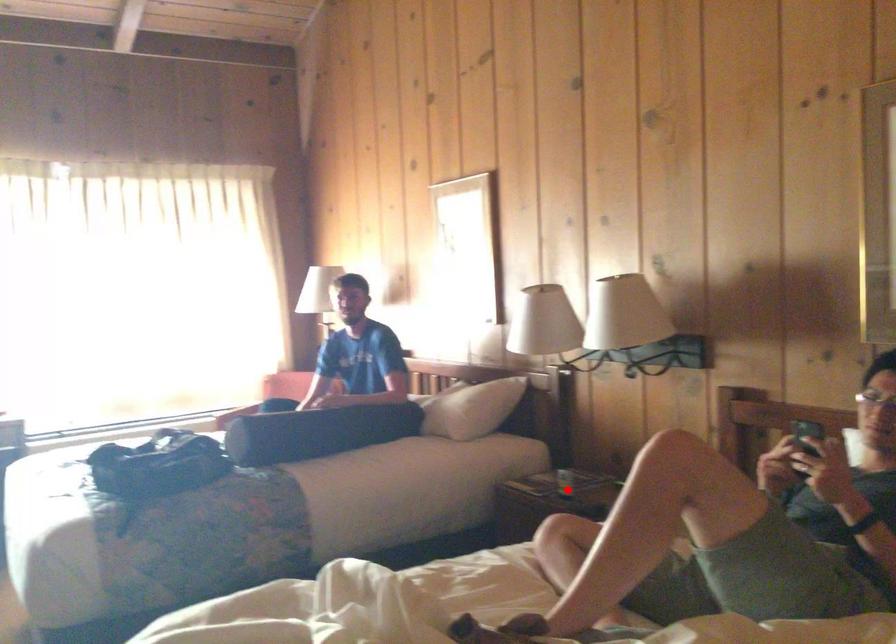
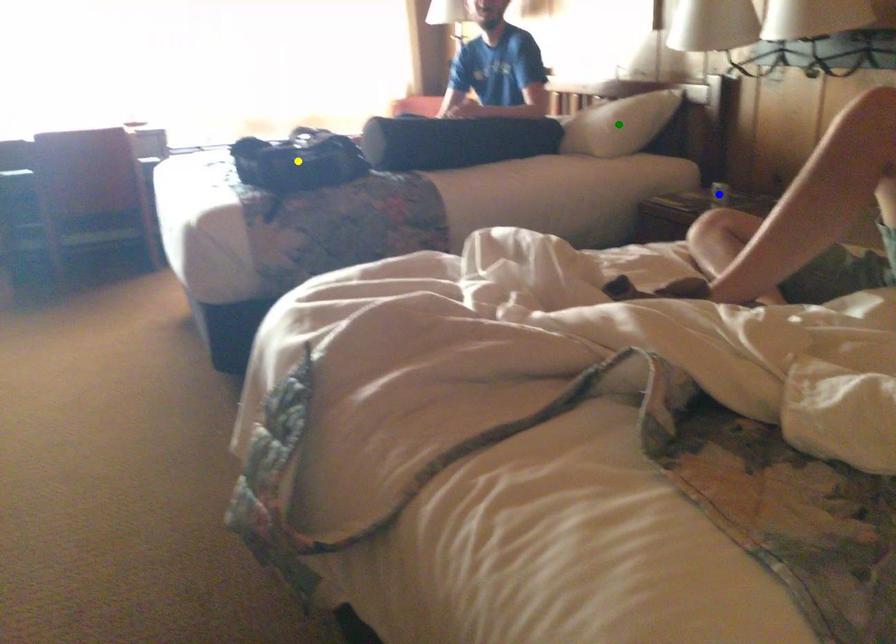
Question: I am providing you with two images of the same scene from different viewpoints. A red point is marked on the first image. You are given multiple points on the second image. Which point in image 2 is actually the same real-world point as the red point in image 1?

Choices:
 (A) green point
 (B) yellow point
 (C) blue point

Answer: (C)